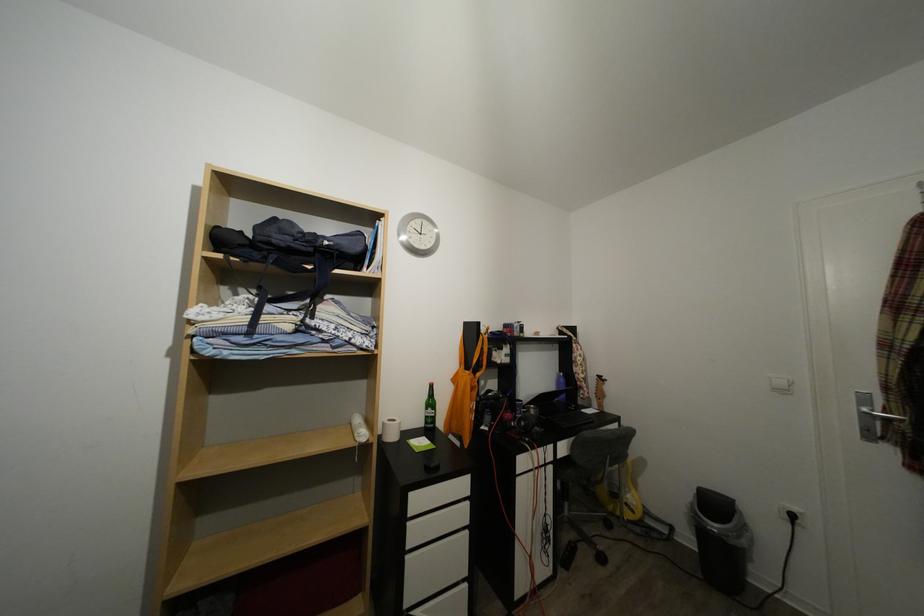
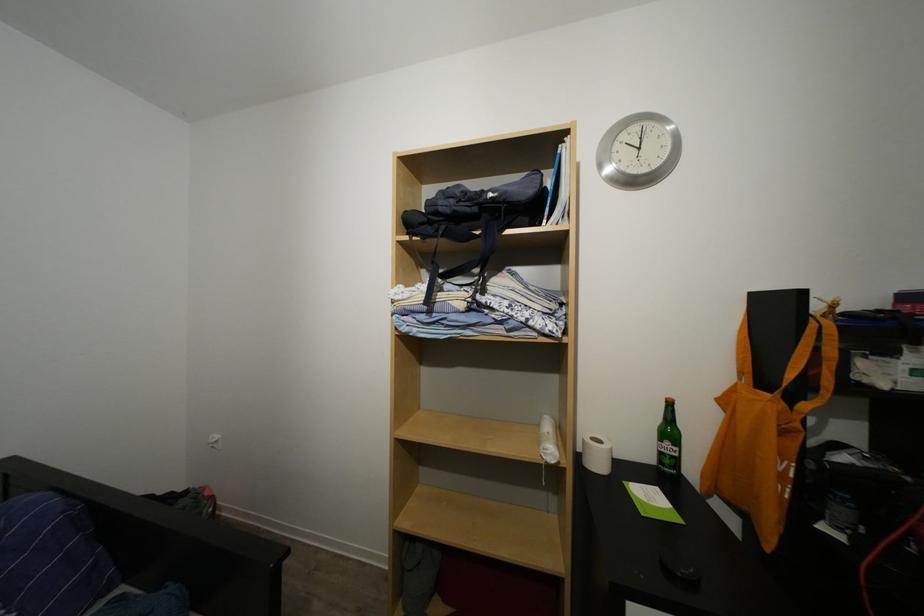
Question: The camera is either moving clockwise (left) or counter-clockwise (right) around the object. The first image is from the beginning of the video and the second image is from the end. Is the camera moving left or right when shooting the video?

Choices:
 (A) Left
 (B) Right

Answer: (B)